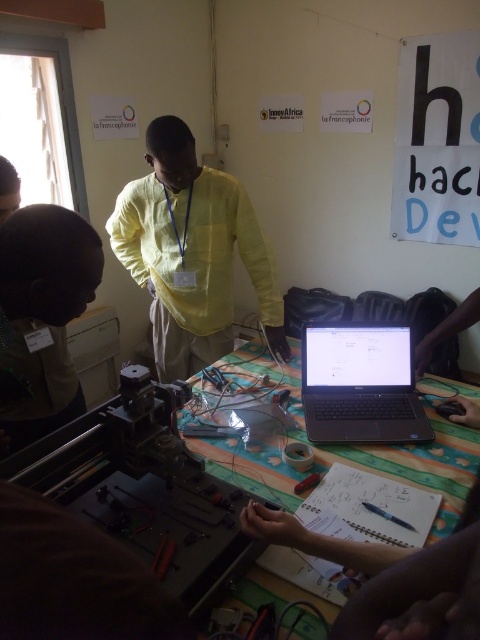
You are a participant in the workshop and need to place both the green fabric table at center and the metallic red screwdriver at center on a shelf. Which object should you place first if you want to maximize the shelf space?

The green fabric table at center is larger than the metallic red screwdriver at center, so you should place the green fabric table at center first to maximize shelf space.